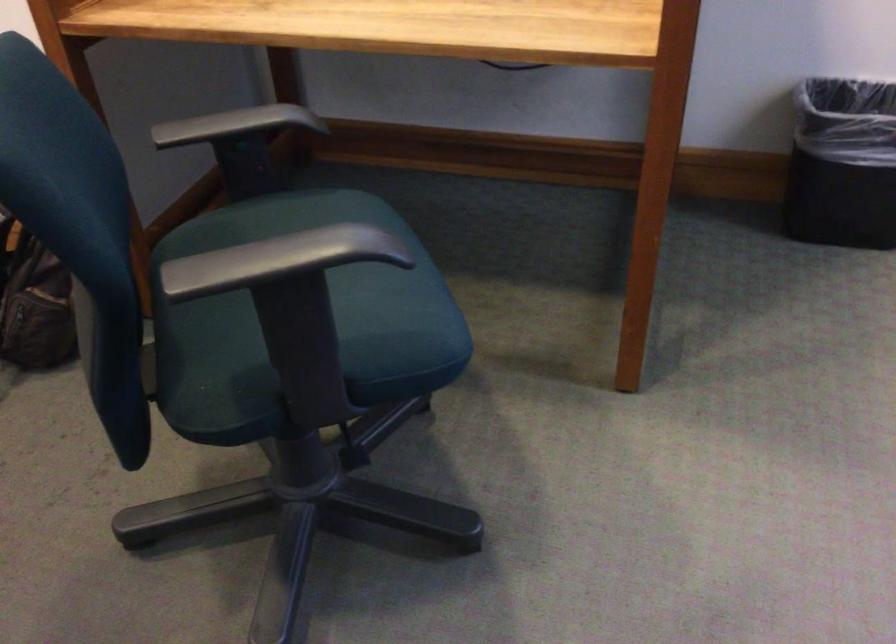
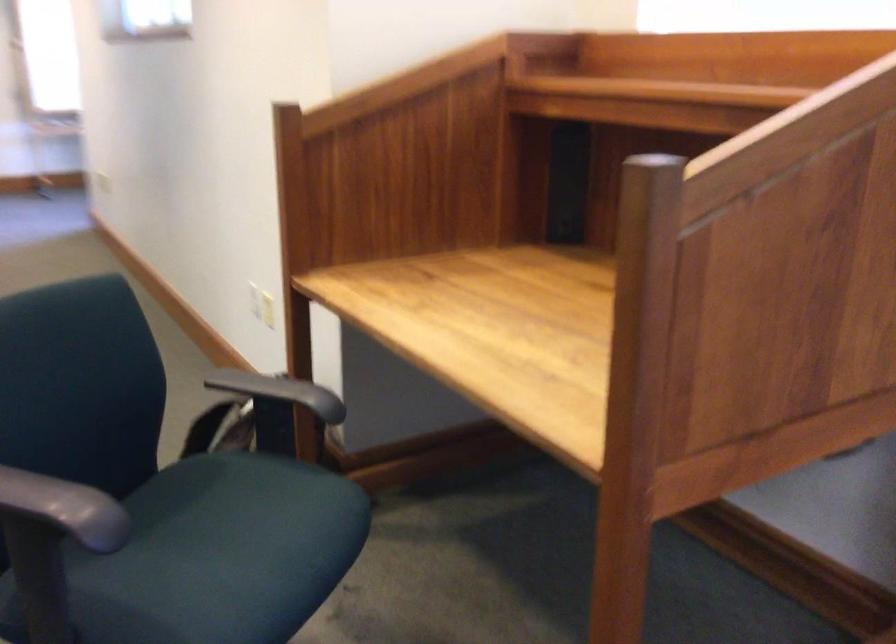
Question: The camera is either moving clockwise (left) or counter-clockwise (right) around the object. The first image is from the beginning of the video and the second image is from the end. Is the camera moving left or right when shooting the video?

Choices:
 (A) Left
 (B) Right

Answer: (B)